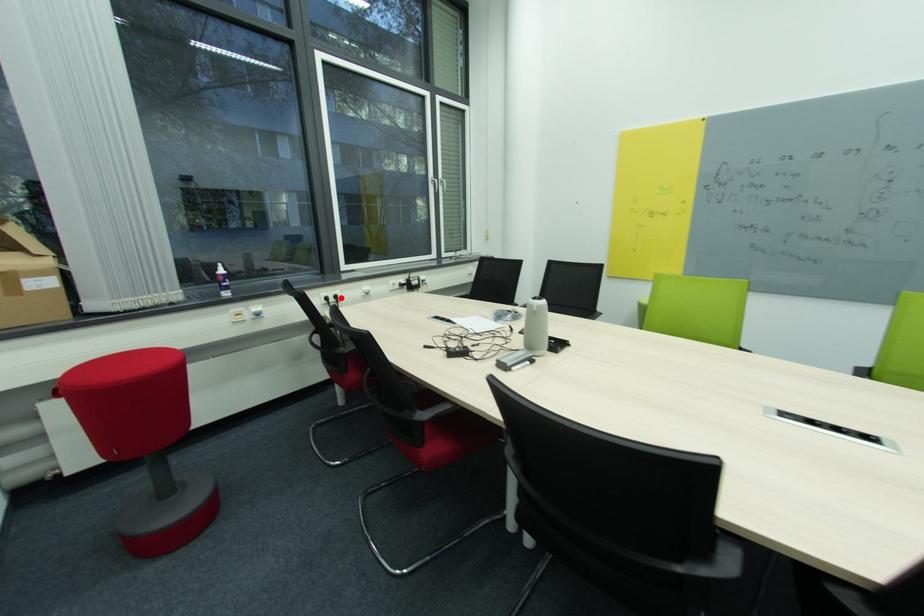
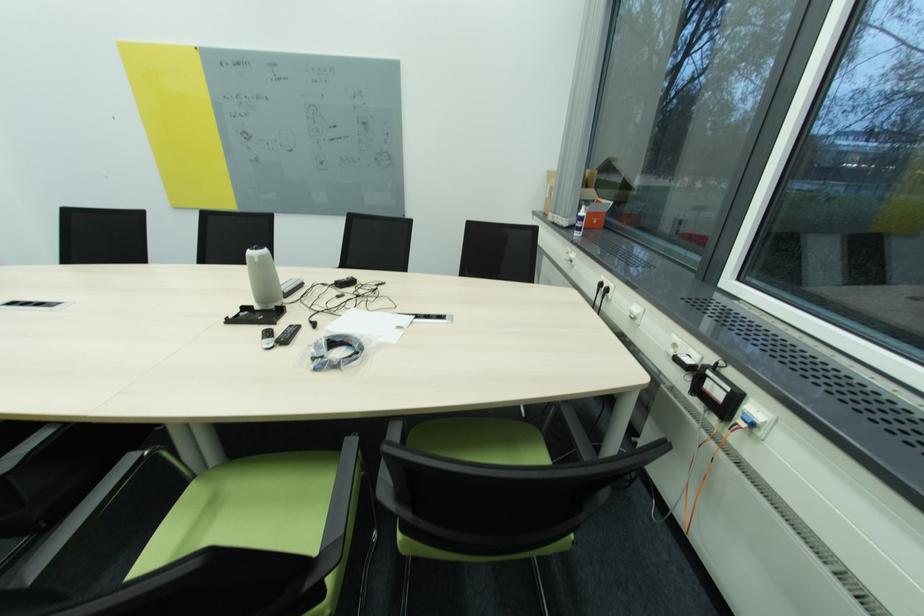
Locate, in the second image, the point that corresponds to the highlighted location in the first image.

(612, 291)